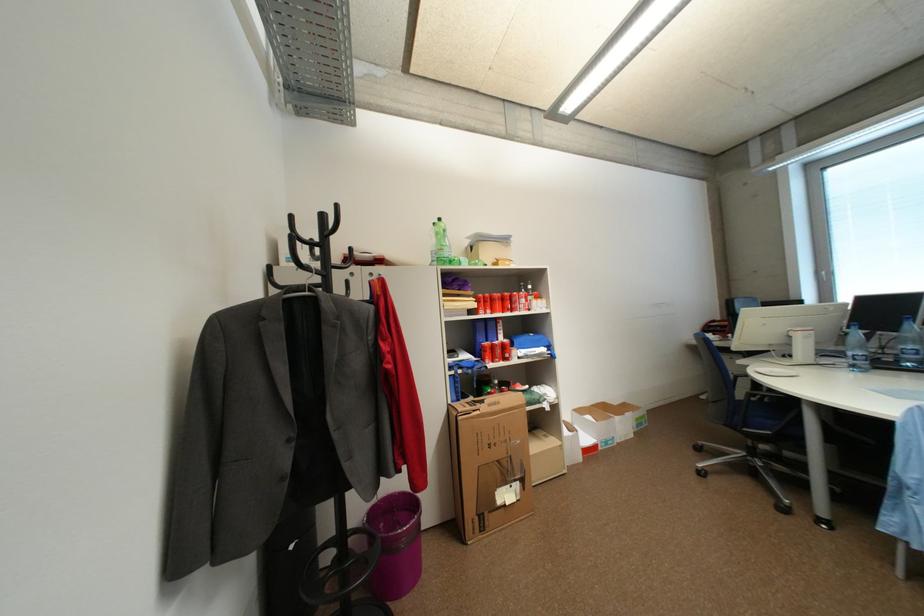
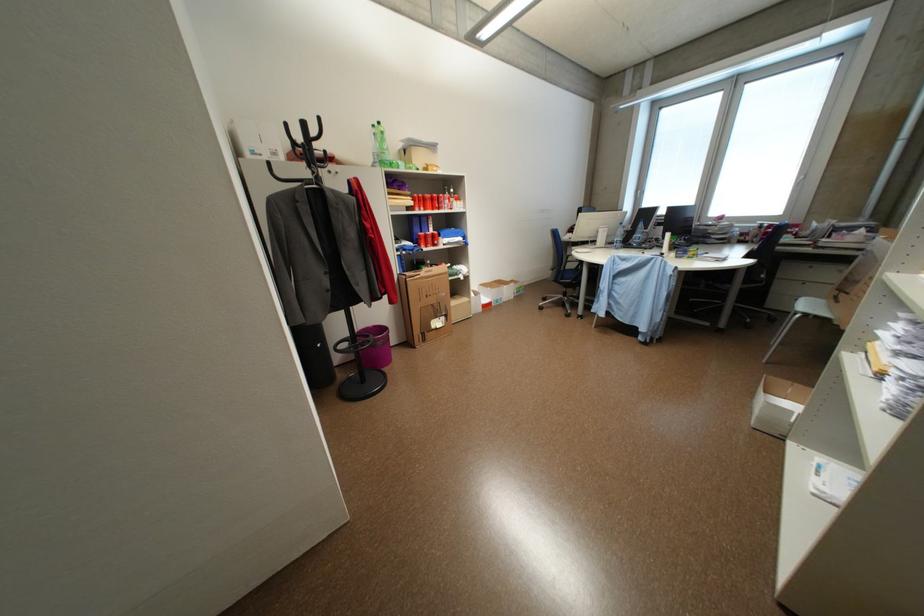
The point at [443,225] is marked in the first image. Where is the corresponding point in the second image?

(382, 127)